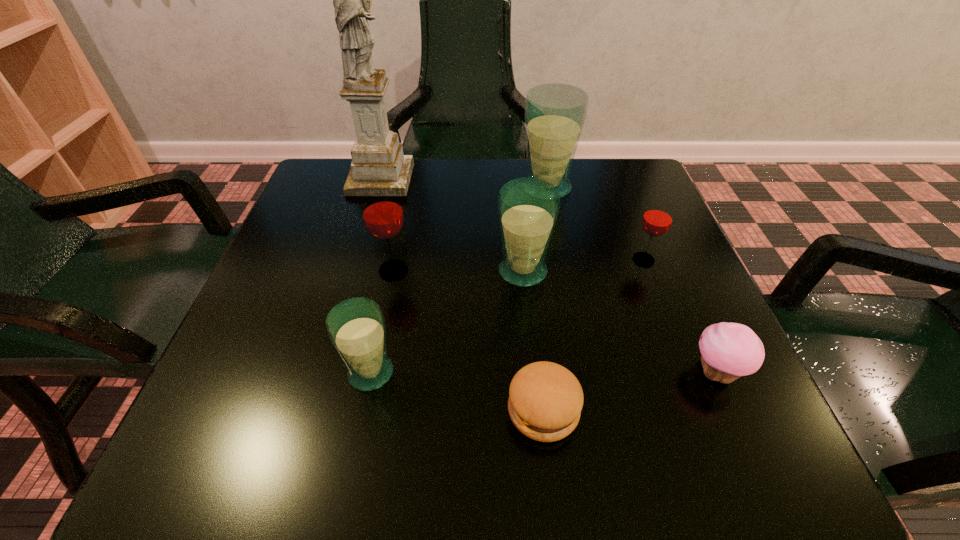
The width and height of the screenshot is (960, 540). I want to click on free point between the pink cupcake and the tallest object, so click(548, 276).

The height and width of the screenshot is (540, 960). Identify the location of vacant area that lies between the second tallest object and the pink cupcake. (631, 280).

This screenshot has height=540, width=960. What are the coordinates of `free area in between the seventh shortest object and the second shortest object` in the screenshot? It's located at (631, 280).

The width and height of the screenshot is (960, 540). Identify the location of object that stands as the fifth closest to the tallest glass. (728, 351).

Where is `object that stands as the third closest to the shortest object`? object that stands as the third closest to the shortest object is located at coordinates (x=528, y=207).

Identify which glass is the fourth nearest to the pink cupcake. Please provide its 2D coordinates. Your answer should be formatted as a tuple, i.e. [(x, y)], where the tuple contains the x and y coordinates of a point satisfying the conditions above.

[(356, 327)]

Where is `glass that is the third closest to the biggest blue glass`? The width and height of the screenshot is (960, 540). glass that is the third closest to the biggest blue glass is located at coordinates (383, 216).

Identify which blue glass is the nearest to the hamburger. Please provide its 2D coordinates. Your answer should be formatted as a tuple, i.e. [(x, y)], where the tuple contains the x and y coordinates of a point satisfying the conditions above.

[(356, 327)]

The width and height of the screenshot is (960, 540). Find the location of `blue glass object that ranks as the third closest to the brown hamburger`. blue glass object that ranks as the third closest to the brown hamburger is located at coordinates (555, 113).

At what (x,y) coordinates should I click in order to perform the action: click on free space that satisfies the following two spatial constraints: 1. on the front side of the second biggest blue glass; 2. on the left side of the cupcake. Please return your answer as a coordinate pair (x, y). Looking at the image, I should click on (533, 373).